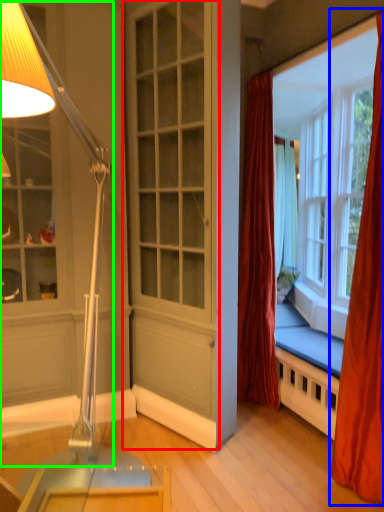
Question: Considering the real-world distances, which object is closest to screen door (highlighted by a red box)? curtain (highlighted by a blue box) or lamp (highlighted by a green box).

Choices:
 (A) curtain
 (B) lamp

Answer: (B)